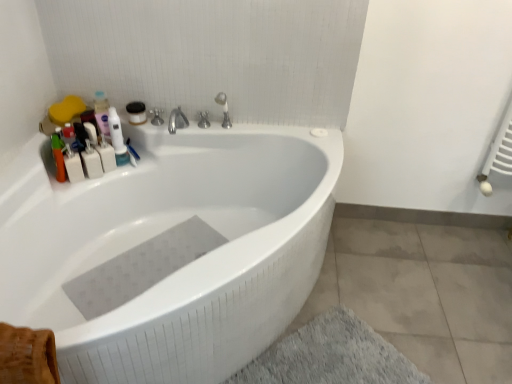
Question: Is polished chrome faucet at upper center, placed as the first tap when sorted from left to right, in contact with white glossy bathtub at upper center?

Choices:
 (A) no
 (B) yes

Answer: (A)

Question: From a real-world perspective, is polished chrome faucet at upper center, placed as the first tap when sorted from left to right, on white glossy bathtub at upper center?

Choices:
 (A) no
 (B) yes

Answer: (B)

Question: Considering the relative positions of polished chrome faucet at upper center, positioned as the 2th tap in right-to-left order, and white glossy bathtub at upper center in the image provided, is polished chrome faucet at upper center, positioned as the 2th tap in right-to-left order, in front of white glossy bathtub at upper center?

Choices:
 (A) no
 (B) yes

Answer: (A)

Question: Considering the relative sizes of polished chrome faucet at upper center, positioned as the 2th tap in right-to-left order, and white glossy bathtub at upper center in the image provided, is polished chrome faucet at upper center, positioned as the 2th tap in right-to-left order, wider than white glossy bathtub at upper center?

Choices:
 (A) yes
 (B) no

Answer: (B)

Question: Can we say polished chrome faucet at upper center, placed as the first tap when sorted from left to right, lies outside white glossy bathtub at upper center?

Choices:
 (A) no
 (B) yes

Answer: (B)

Question: Considering the positions of white plastic bottles at upper left and white glossy bottle at upper left in the image, is white plastic bottles at upper left taller or shorter than white glossy bottle at upper left?

Choices:
 (A) short
 (B) tall

Answer: (A)

Question: Considering their positions, is white plastic bottles at upper left located in front of or behind white glossy bottle at upper left?

Choices:
 (A) front
 (B) behind

Answer: (A)

Question: Is point (80, 172) closer or farther from the camera than point (117, 160)?

Choices:
 (A) farther
 (B) closer

Answer: (B)

Question: From a real-world perspective, is white plastic bottles at upper left positioned above or below white glossy bottle at upper left?

Choices:
 (A) below
 (B) above

Answer: (A)

Question: Is satin nickel faucet at upper center, the first tap from the right, inside the boundaries of white plastic mouthwash at upper left, which ranks as the 1th mouthwash in right-to-left order, or outside?

Choices:
 (A) inside
 (B) outside

Answer: (B)

Question: Considering the positions of satin nickel faucet at upper center, which appears as the second tap when viewed from the left, and white plastic mouthwash at upper left, the second mouthwash when ordered from left to right, in the image, is satin nickel faucet at upper center, which appears as the second tap when viewed from the left, bigger or smaller than white plastic mouthwash at upper left, the second mouthwash when ordered from left to right,?

Choices:
 (A) small
 (B) big

Answer: (B)

Question: Is point (226, 114) positioned closer to the camera than point (98, 150)?

Choices:
 (A) farther
 (B) closer

Answer: (A)

Question: From a real-world perspective, relative to white plastic mouthwash at upper left, the second mouthwash when ordered from left to right, is satin nickel faucet at upper center, which appears as the second tap when viewed from the left, vertically above or below?

Choices:
 (A) below
 (B) above

Answer: (B)

Question: Which is correct: polished chrome faucet at upper center, placed as the first tap when sorted from left to right, is inside white glossy bathtub at upper center, or outside of it?

Choices:
 (A) inside
 (B) outside

Answer: (B)

Question: From the image's perspective, is polished chrome faucet at upper center, placed as the first tap when sorted from left to right, located above or below white glossy bathtub at upper center?

Choices:
 (A) below
 (B) above

Answer: (B)